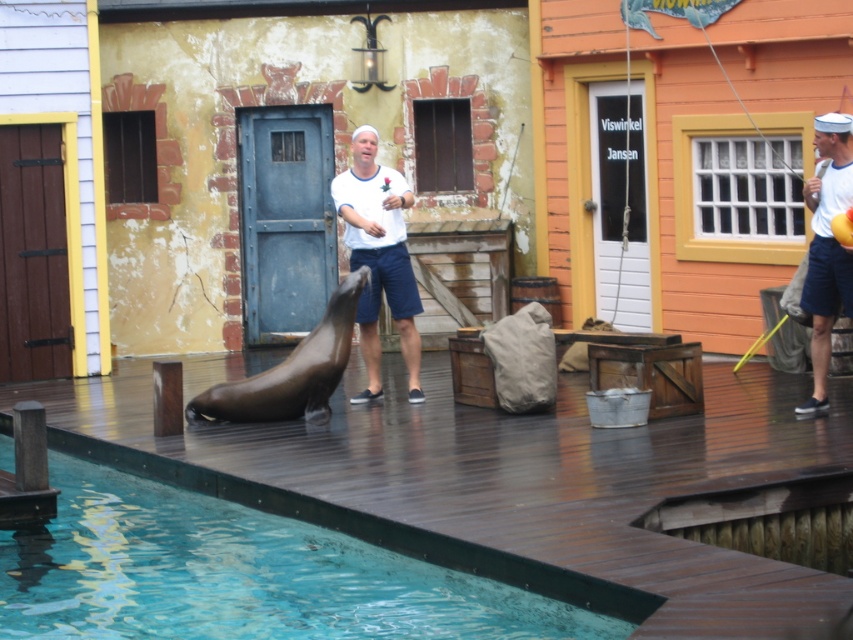
Question: Which point appears closest to the camera in this image?

Choices:
 (A) (172, 548)
 (B) (421, 397)
 (C) (836, 284)

Answer: (A)

Question: Which object is farther from the camera taking this photo?

Choices:
 (A) white cotton shirt at center
 (B) clear blue water at lower left
 (C) white cotton shirt at upper right

Answer: (A)

Question: Does clear blue water at lower left appear over white cotton shirt at center?

Choices:
 (A) yes
 (B) no

Answer: (B)

Question: Is clear blue water at lower left thinner than white cotton shirt at center?

Choices:
 (A) no
 (B) yes

Answer: (A)

Question: Which object is the farthest from the clear blue water at lower left?

Choices:
 (A) white cotton shirt at center
 (B) white cotton shirt at upper right

Answer: (B)

Question: Observing the image, what is the correct spatial positioning of white cotton shirt at center in reference to white cotton shirt at upper right?

Choices:
 (A) right
 (B) left

Answer: (B)